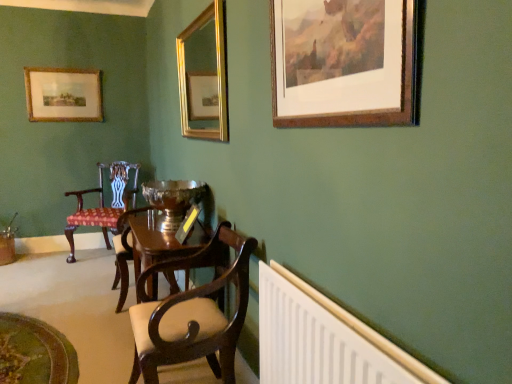
Find the location of `wooden picture frame at upper left, the third picture frame positioned from the front`. wooden picture frame at upper left, the third picture frame positioned from the front is located at coordinates (63, 95).

How much space does polka dot fabric chair at left, which is counted as the 2th chair, starting from the front, occupy horizontally?

polka dot fabric chair at left, which is counted as the 2th chair, starting from the front, is 23.32 inches in width.

This screenshot has width=512, height=384. I want to click on wooden picture frame at upper left, arranged as the third picture frame when viewed from the right, so click(63, 95).

Between white plastic radiator at lower right and polka dot fabric chair at left, which is counted as the 2th chair, starting from the front, which one is positioned behind?

polka dot fabric chair at left, which is counted as the 2th chair, starting from the front, is further from the camera.

Considering the relative positions of white plastic radiator at lower right and polka dot fabric chair at left, which ranks as the 1th chair in back-to-front order, in the image provided, is white plastic radiator at lower right to the left or to the right of polka dot fabric chair at left, which ranks as the 1th chair in back-to-front order,?

Clearly, white plastic radiator at lower right is on the right of polka dot fabric chair at left, which ranks as the 1th chair in back-to-front order, in the image.

Which is in front, point (315, 371) or point (99, 222)?

The point (315, 371) is closer.

Where is `picture frame that is above the gold metallic mirror at upper center, the 2th picture frame when ordered from front to back (from a real-world perspective)`? The height and width of the screenshot is (384, 512). picture frame that is above the gold metallic mirror at upper center, the 2th picture frame when ordered from front to back (from a real-world perspective) is located at coordinates pos(63,95).

Measure the distance between gold metallic mirror at upper center, which is the 2th picture frame from right to left, and wooden picture frame at upper left, the 1th picture frame from the left.

gold metallic mirror at upper center, which is the 2th picture frame from right to left, and wooden picture frame at upper left, the 1th picture frame from the left, are 4.16 feet apart from each other.

Which of these two, gold metallic mirror at upper center, the 2th picture frame when ordered from front to back, or wooden picture frame at upper left, the first picture frame positioned from the back, is thinner?

With smaller width is wooden picture frame at upper left, the first picture frame positioned from the back.

From a real-world perspective, is gold metallic mirror at upper center, marked as the 2th picture frame in a left-to-right arrangement, positioned above or below wooden picture frame at upper left, the third picture frame positioned from the front?

Clearly, from a real-world perspective, gold metallic mirror at upper center, marked as the 2th picture frame in a left-to-right arrangement, is below wooden picture frame at upper left, the third picture frame positioned from the front.

Measure the distance between gold metallic mirror at upper center, the second picture frame viewed from the back, and mahogany wood armchair at center.

A distance of 1.80 meters exists between gold metallic mirror at upper center, the second picture frame viewed from the back, and mahogany wood armchair at center.

How different are the orientations of gold metallic mirror at upper center, marked as the 2th picture frame in a left-to-right arrangement, and mahogany wood armchair at center in degrees?

The angle between the facing direction of gold metallic mirror at upper center, marked as the 2th picture frame in a left-to-right arrangement, and the facing direction of mahogany wood armchair at center is 0.912 degrees.

Could you tell me if gold metallic mirror at upper center, which is the 2th picture frame from right to left, is turned towards mahogany wood armchair at center?

No, gold metallic mirror at upper center, which is the 2th picture frame from right to left, is not aimed at mahogany wood armchair at center.

Is gold metallic mirror at upper center, the second picture frame viewed from the back, smaller than mahogany wood armchair at center?

Yes.

Locate an element on the screen. picture frame that is the 2nd one above the mahogany wood chair at center, placed as the first chair when sorted from front to back (from a real-world perspective) is located at coordinates (204, 75).

From the image's perspective, is gold metallic mirror at upper center, which is the 2th picture frame from right to left, beneath mahogany wood chair at center, placed as the 2th chair when sorted from back to front?

Actually, gold metallic mirror at upper center, which is the 2th picture frame from right to left, appears above mahogany wood chair at center, placed as the 2th chair when sorted from back to front, in the image.

Which point is more forward, (208, 14) or (175, 358)?

Point (175, 358)

Which object is further away from the camera, gold metallic mirror at upper center, which is the 2th picture frame from right to left, or mahogany wood chair at center, placed as the first chair when sorted from front to back?

gold metallic mirror at upper center, which is the 2th picture frame from right to left, is further away from the camera.

Does point (82, 197) lie in front of point (283, 4)?

That is False.

From the picture: From the image's perspective, is polka dot fabric chair at left, which ranks as the 1th chair in back-to-front order, beneath brown wooden picture frame at upper right, which is the 3th picture frame in left-to-right order?

Yes, from the image's perspective, polka dot fabric chair at left, which ranks as the 1th chair in back-to-front order, is below brown wooden picture frame at upper right, which is the 3th picture frame in left-to-right order.

Considering the positions of objects polka dot fabric chair at left, the second chair positioned from the right, and brown wooden picture frame at upper right, the third picture frame from the back, in the image provided, who is more to the left, polka dot fabric chair at left, the second chair positioned from the right, or brown wooden picture frame at upper right, the third picture frame from the back,?

polka dot fabric chair at left, the second chair positioned from the right.

Is polka dot fabric chair at left, which is the first chair from left to right, positioned with its back to brown wooden picture frame at upper right, arranged as the first picture frame when viewed from the right?

No, polka dot fabric chair at left, which is the first chair from left to right,'s orientation is not away from brown wooden picture frame at upper right, arranged as the first picture frame when viewed from the right.

From a real-world perspective, who is located higher, white plastic radiator at lower right or mahogany wood chair at center, which appears as the 2th chair when viewed from the left?

white plastic radiator at lower right is physically above.

From the image's perspective, which one is positioned higher, white plastic radiator at lower right or mahogany wood chair at center, placed as the 2th chair when sorted from back to front?

mahogany wood chair at center, placed as the 2th chair when sorted from back to front.

Considering the sizes of objects white plastic radiator at lower right and mahogany wood chair at center, which appears as the 2th chair when viewed from the left, in the image provided, who is smaller, white plastic radiator at lower right or mahogany wood chair at center, which appears as the 2th chair when viewed from the left,?

white plastic radiator at lower right.

Is white plastic radiator at lower right situated inside mahogany wood chair at center, placed as the 2th chair when sorted from back to front, or outside?

white plastic radiator at lower right is located beyond the bounds of mahogany wood chair at center, placed as the 2th chair when sorted from back to front.

From a real-world perspective, who is located lower, polka dot fabric chair at left, which is counted as the 2th chair, starting from the front, or mahogany wood armchair at center?

mahogany wood armchair at center, from a real-world perspective.

Who is taller, polka dot fabric chair at left, which ranks as the 1th chair in back-to-front order, or mahogany wood armchair at center?

With more height is polka dot fabric chair at left, which ranks as the 1th chair in back-to-front order.

Could you tell me if polka dot fabric chair at left, which is counted as the 2th chair, starting from the front, is facing mahogany wood armchair at center?

No, polka dot fabric chair at left, which is counted as the 2th chair, starting from the front, is not facing towards mahogany wood armchair at center.

This screenshot has height=384, width=512. Find the location of `radiator in front of the polka dot fabric chair at left, which is the first chair from left to right`. radiator in front of the polka dot fabric chair at left, which is the first chair from left to right is located at coordinates (314, 340).

From the wooden picture frame at upper left, the third picture frame positioned from the front, count 1st picture frame to the right and point to it. Please provide its 2D coordinates.

[(204, 75)]

Considering their positions, is gold metallic mirror at upper center, the 2th picture frame when ordered from front to back, positioned closer to polka dot fabric chair at left, which is the first chair from left to right, than mahogany wood chair at center, which appears as the 2th chair when viewed from the left?

gold metallic mirror at upper center, the 2th picture frame when ordered from front to back, is closer to polka dot fabric chair at left, which is the first chair from left to right.

From the image, which object appears to be nearer to mahogany wood chair at center, placed as the 2th chair when sorted from back to front, brown wooden picture frame at upper right, arranged as the first picture frame when viewed from the right, or white plastic radiator at lower right?

Among the two, white plastic radiator at lower right is located nearer to mahogany wood chair at center, placed as the 2th chair when sorted from back to front.

Estimate the real-world distances between objects in this image. Which object is closer to polka dot fabric chair at left, which is the first chair from left to right, wooden picture frame at upper left, the third picture frame positioned from the front, or mahogany wood armchair at center?

mahogany wood armchair at center lies closer to polka dot fabric chair at left, which is the first chair from left to right, than the other object.

Which object lies further to the anchor point wooden picture frame at upper left, the third picture frame positioned from the front, mahogany wood chair at center, arranged as the 1th chair when viewed from the right, or brown wooden picture frame at upper right, the third picture frame from the back?

Among the two, brown wooden picture frame at upper right, the third picture frame from the back, is located further to wooden picture frame at upper left, the third picture frame positioned from the front.

Which object lies nearer to the anchor point white plastic radiator at lower right, wooden picture frame at upper left, arranged as the third picture frame when viewed from the right, or gold metallic mirror at upper center, which is the 2th picture frame from right to left?

gold metallic mirror at upper center, which is the 2th picture frame from right to left, is positioned closer to the anchor white plastic radiator at lower right.

When comparing their distances from mahogany wood chair at center, arranged as the 1th chair when viewed from the right, does polka dot fabric chair at left, which is counted as the 2th chair, starting from the front, or white plastic radiator at lower right seem closer?

white plastic radiator at lower right lies closer to mahogany wood chair at center, arranged as the 1th chair when viewed from the right, than the other object.

Considering their positions, is mahogany wood armchair at center positioned closer to mahogany wood chair at center, placed as the 2th chair when sorted from back to front, than polka dot fabric chair at left, the second chair positioned from the right?

The object closer to mahogany wood chair at center, placed as the 2th chair when sorted from back to front, is mahogany wood armchair at center.

Based on their spatial positions, is brown wooden picture frame at upper right, the first picture frame from the front, or gold metallic mirror at upper center, which is the 2th picture frame from right to left, further from mahogany wood armchair at center?

Among the two, brown wooden picture frame at upper right, the first picture frame from the front, is located further to mahogany wood armchair at center.

Locate an element on the screen. chair between white plastic radiator at lower right and mahogany wood armchair at center from front to back is located at coordinates (193, 312).

Where is `picture frame between white plastic radiator at lower right and gold metallic mirror at upper center, which is the 2th picture frame from right to left, along the z-axis`? picture frame between white plastic radiator at lower right and gold metallic mirror at upper center, which is the 2th picture frame from right to left, along the z-axis is located at coordinates [x=343, y=62].

Locate an element on the screen. Image resolution: width=512 pixels, height=384 pixels. armchair between gold metallic mirror at upper center, the second picture frame viewed from the back, and mahogany wood chair at center, placed as the first chair when sorted from front to back, in the vertical direction is located at coordinates (124, 253).

At what (x,y) coordinates should I click in order to perform the action: click on chair between brown wooden picture frame at upper right, the third picture frame from the back, and polka dot fabric chair at left, which ranks as the 1th chair in back-to-front order, in the front-back direction. Please return your answer as a coordinate pair (x, y). This screenshot has height=384, width=512. Looking at the image, I should click on 193,312.